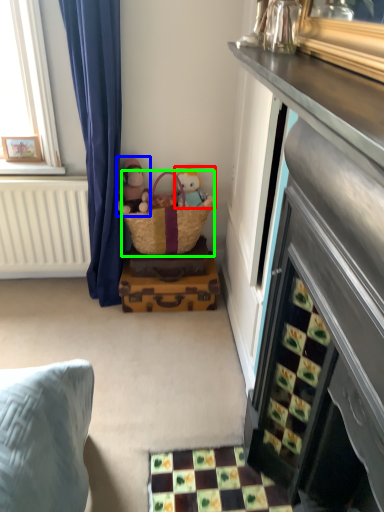
Question: Which is nearer to the toy (highlighted by a red box)? doll (highlighted by a blue box) or picnic basket (highlighted by a green box).

Choices:
 (A) doll
 (B) picnic basket

Answer: (B)